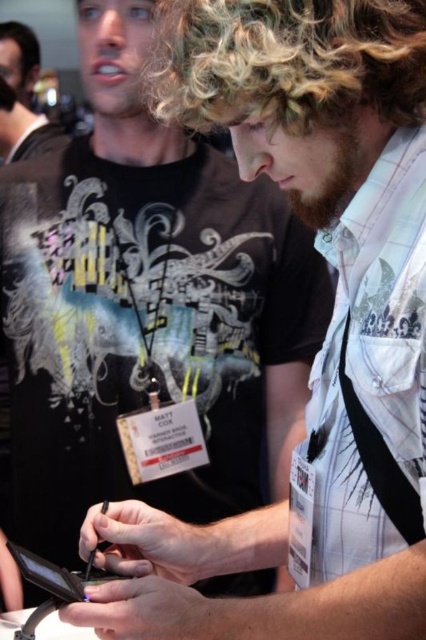
You are a photographer trying to capture a clear shot of both the white textured shirt at center and the dark brown curly hair at upper left in the scene. Given their sizes in the image, which one would appear larger in your photo?

The white textured shirt at center appears larger in the photo because it is much taller than the dark brown curly hair at upper left.

You are observing two people in a scene. The person in the foreground has dark brown curly hair at upper left and is wearing a matte black shirt at upper left. The other person is in the background. Based on their positions, can you determine which object is closer to the viewer?

The dark brown curly hair at upper left is closer to the viewer because it is positioned to the left of the matte black shirt at upper left, which is to its right. Since the shirt is to the right of the hair, the hair must be closer.

You are standing in a room and see the matte black shirt at upper left. If you want to reach it without moving your feet, can you do it?

The matte black shirt at upper left is 7.23 feet away from the viewer, so if you can reach that far without moving your feet, you might be able to. However, typical human reaching distance is about 2.5 to 3 feet, so it may be out of reach.